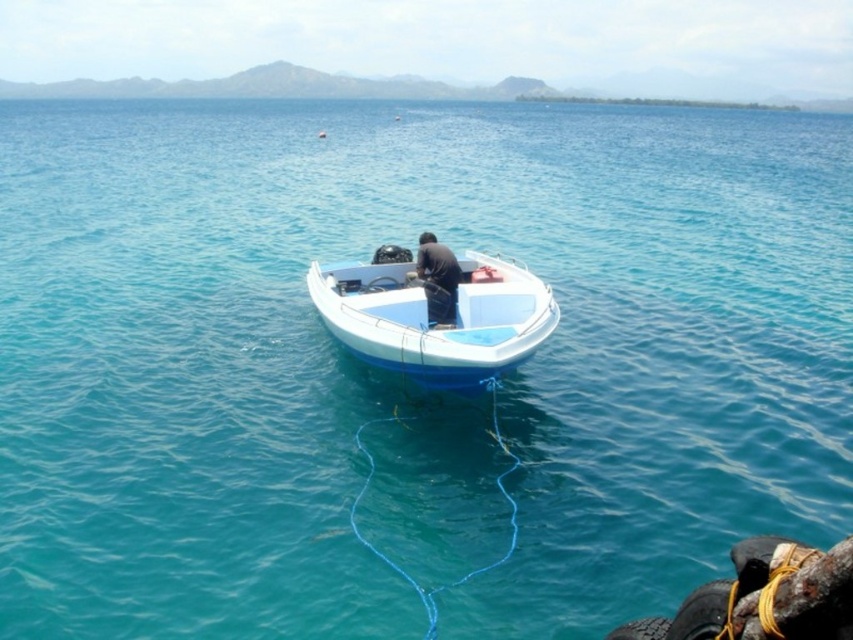
Does white plastic boat at center appear on the left side of dark blue fabric at center?

Correct, you'll find white plastic boat at center to the left of dark blue fabric at center.

Who is more forward, (347, 298) or (433, 301)?

Point (433, 301) is more forward.

Describe the element at coordinates (434, 317) in the screenshot. I see `white plastic boat at center` at that location.

Where is `white plastic boat at center`? The image size is (853, 640). white plastic boat at center is located at coordinates (434, 317).